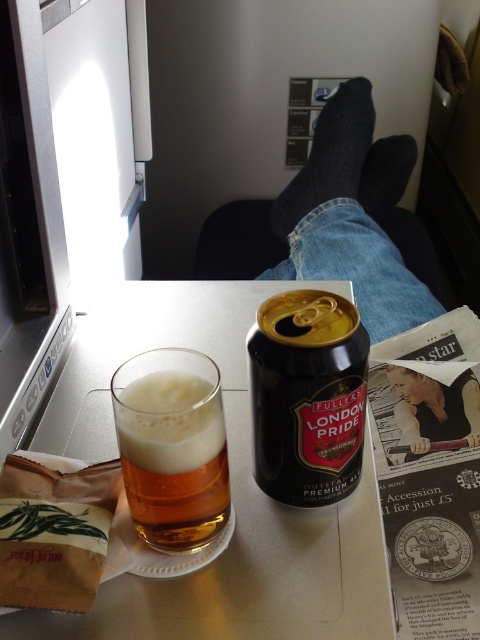
You are a flight attendant checking the cabin. You see the point marked at coordinate (352, 214). What object is located at that point?

The dark gray socks at upper center is located at coordinate point (352, 214).

You are a flight attendant checking the cabin. You see the dark gray socks at upper center and the black matte can at center. Which object is located higher in the image?

The dark gray socks at upper center is located higher in the image than the black matte can at center.

You are a flight attendant carrying a tray of snacks. You need to place a new drink on the table so that it is exactly 6 inches away from the translucent plastic tray at center. Is the current position of the amber glass at left suitable for this requirement?

The distance between the translucent plastic tray at center and the amber glass at left is 5.77 inches. Since 5.77 inches is less than 6 inches, placing the drink where the amber glass at left currently is would not meet the requirement of being exactly 6 inches away from the tray.